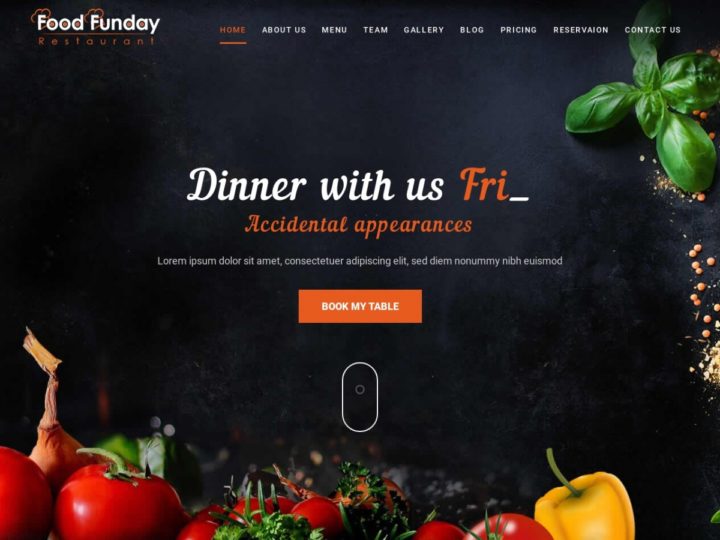
Identify the location of chalk board. The image size is (720, 540). (512, 372).